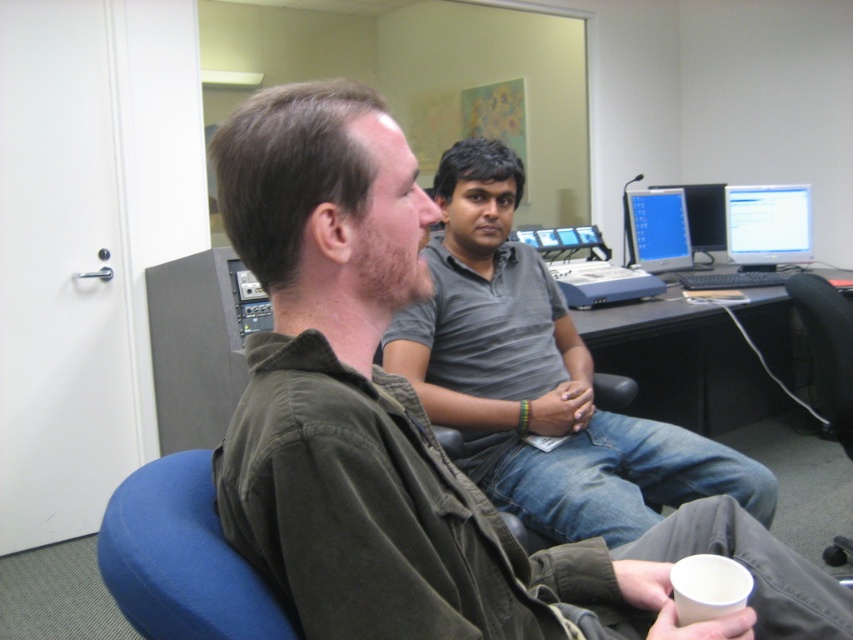
Question: Can you confirm if green cotton shirt at center is positioned to the left of matte gray monitor at upper right?

Choices:
 (A) yes
 (B) no

Answer: (A)

Question: Is green cotton shirt at center to the left of matte blue monitor at upper right from the viewer's perspective?

Choices:
 (A) yes
 (B) no

Answer: (A)

Question: Which object is closer to the camera taking this photo?

Choices:
 (A) gray cotton shirt at center
 (B) matte gray monitor at upper right

Answer: (A)

Question: Does green cotton shirt at center come in front of black plastic chair at lower right?

Choices:
 (A) yes
 (B) no

Answer: (A)

Question: Estimate the real-world distances between objects in this image. Which object is farther from the black plastic computer desk at center?

Choices:
 (A) black plastic chair at lower right
 (B) green cotton shirt at center

Answer: (B)

Question: Which point is farther to the camera?

Choices:
 (A) (816, 410)
 (B) (788, 200)
 (C) (187, 460)

Answer: (A)